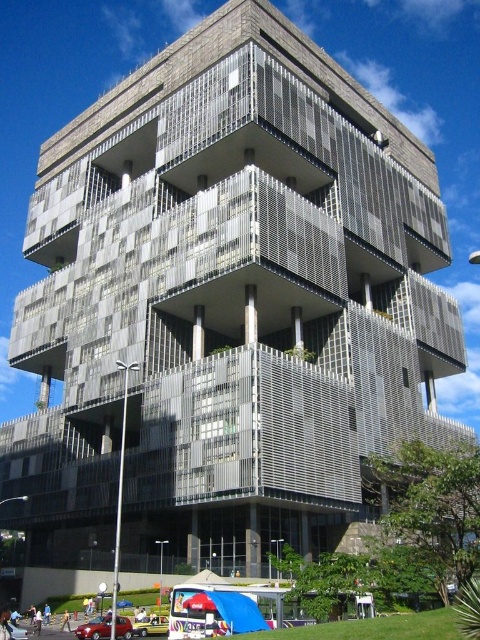
Does matte red car at lower left have a larger size compared to yellow matte car at lower center?

No, matte red car at lower left is not bigger than yellow matte car at lower center.

Which is more to the left, matte red car at lower left or yellow matte car at lower center?

Positioned to the left is matte red car at lower left.

Where is `matte red car at lower left`? This screenshot has height=640, width=480. matte red car at lower left is located at coordinates (95, 628).

Between matte red car at lower left and metallic silver car at lower left, which one appears on the left side from the viewer's perspective?

metallic silver car at lower left

Measure the distance between matte red car at lower left and camera.

The distance of matte red car at lower left from camera is 37.79 meters.

Identify the location of matte red car at lower left. This screenshot has height=640, width=480. (95, 628).

Is yellow matte car at lower center bigger than metallic silver car at lower left?

Actually, yellow matte car at lower center might be smaller than metallic silver car at lower left.

Is yellow matte car at lower center positioned in front of metallic silver car at lower left?

No, yellow matte car at lower center is behind metallic silver car at lower left.

What are the coordinates of `yellow matte car at lower center` in the screenshot? It's located at (151, 625).

Where is `yellow matte car at lower center`? yellow matte car at lower center is located at coordinates (151, 625).